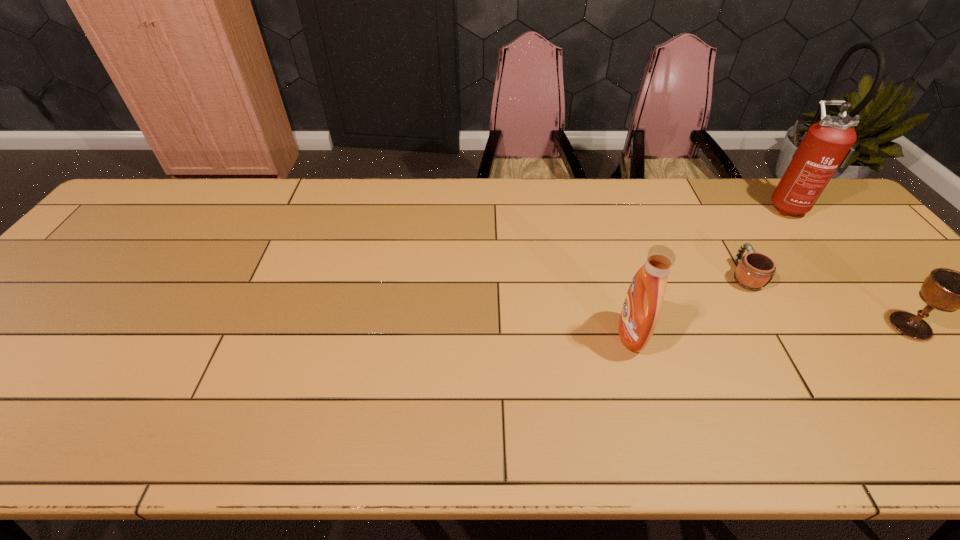
Locate an element on the screen. Image resolution: width=960 pixels, height=540 pixels. object that is at the far right corner is located at coordinates (826, 145).

The height and width of the screenshot is (540, 960). Identify the location of vacant space at the far edge. (204, 214).

Locate an element on the screen. The image size is (960, 540). vacant space at the near edge of the desktop is located at coordinates (360, 410).

The image size is (960, 540). Identify the location of vacant space at the left edge of the desktop. click(x=108, y=266).

In the image, there is a desktop. In order to click on free region at the right edge in this screenshot , I will do `click(821, 230)`.

Where is `vacant space at the far left corner of the desktop`? The height and width of the screenshot is (540, 960). vacant space at the far left corner of the desktop is located at coordinates (173, 178).

This screenshot has width=960, height=540. In the image, there is a desktop. Identify the location of vacant space at the far right corner. (844, 222).

Locate an element on the screen. The width and height of the screenshot is (960, 540). empty space between the second tallest object and the chalice is located at coordinates click(x=771, y=330).

Where is `vacant area between the third shortest object and the farthest object`? vacant area between the third shortest object and the farthest object is located at coordinates (708, 269).

You are a GUI agent. You are given a task and a screenshot of the screen. Output one action in this format:
    pyautogui.click(x=<x>, y=<y>)
    Task: Click on the free point between the third tallest object and the tallest object
    This screenshot has height=540, width=960.
    Given the screenshot: What is the action you would take?
    pyautogui.click(x=849, y=265)